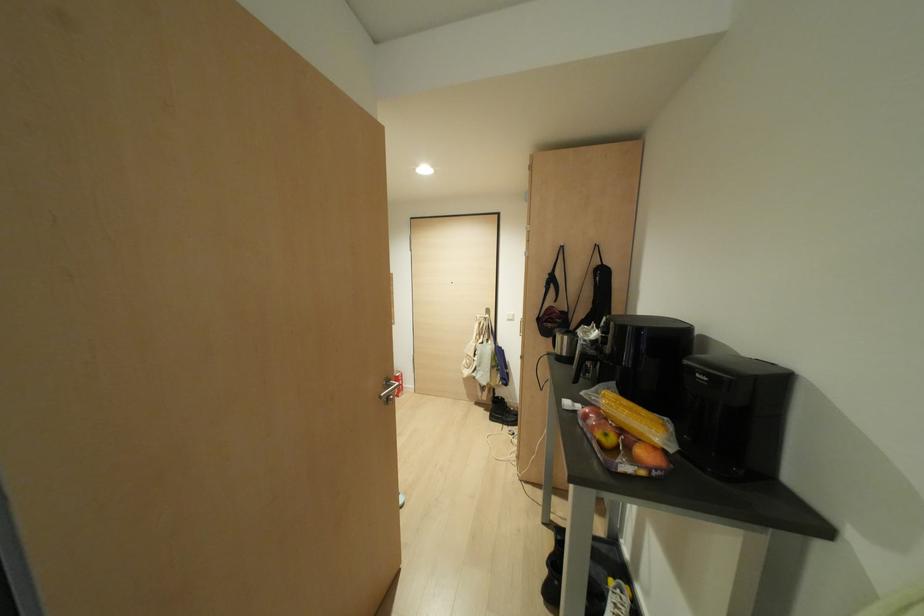
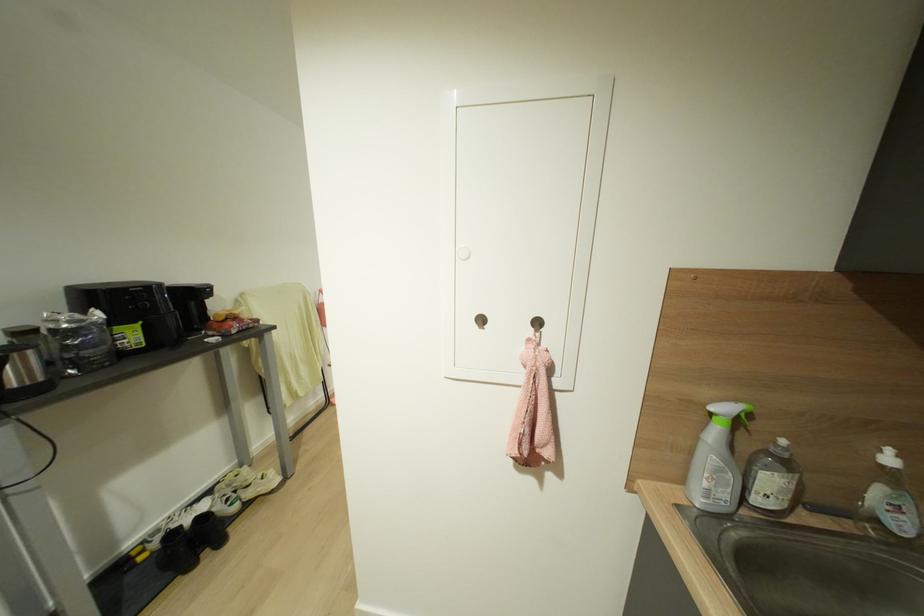
Question: I am providing you with two images of the same scene from different viewpoints. Please identify which objects are invisible in image2.

Choices:
 (A) green spray trigger
 (B) kettle handle
 (C) soap dispenser pump
 (D) green slipper

Answer: (B)